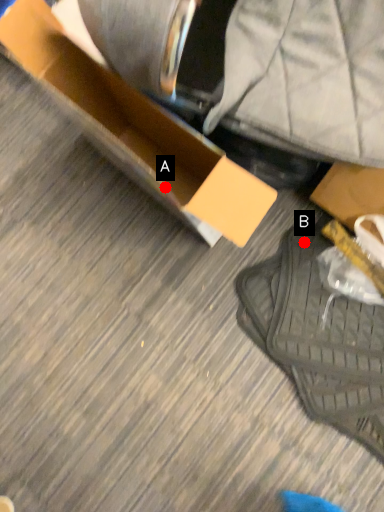
Question: Two points are circled on the image, labeled by A and B beside each circle. Which of the following is the closest to the observer?

Choices:
 (A) A is closer
 (B) B is closer

Answer: (B)